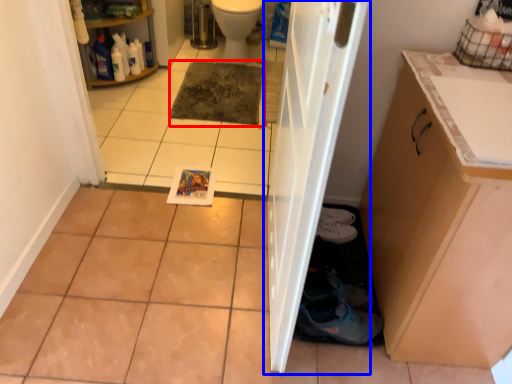
Question: Among these objects, which one is farthest to the camera, mat (highlighted by a red box) or door (highlighted by a blue box)?

Choices:
 (A) mat
 (B) door

Answer: (A)